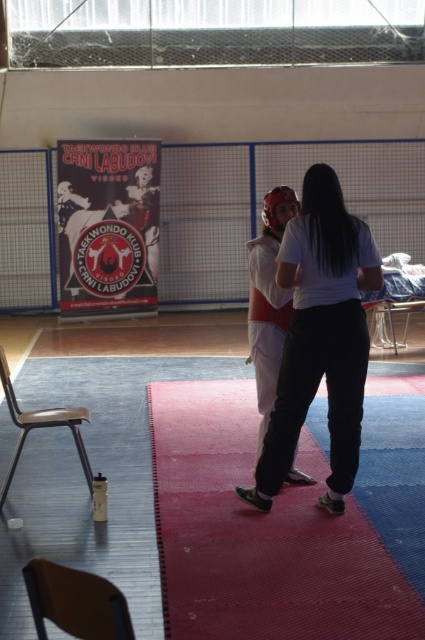
Between rubberized red mat at center and white cotton t-shirt at center, which one appears on the left side from the viewer's perspective?

rubberized red mat at center

Between point (229, 486) and point (260, 460), which one is positioned behind?

Point (229, 486)

Does point (311, 465) lie behind point (336, 204)?

Yes, point (311, 465) is farther from viewer.

Where is `rubberized red mat at center`? This screenshot has width=425, height=640. rubberized red mat at center is located at coordinates (260, 536).

Between point (190, 499) and point (265, 404), which one is positioned behind?

The point (265, 404) is more distant.

Can you confirm if rubberized red mat at center is bigger than white matte/soft t-shirt at center?

Indeed, rubberized red mat at center has a larger size compared to white matte/soft t-shirt at center.

Consider the image. Who is more distant from viewer, (238, 529) or (282, 220)?

The point (282, 220) is behind.

The width and height of the screenshot is (425, 640). I want to click on rubberized red mat at center, so click(x=260, y=536).

Between point (337, 458) and point (251, 266), which one is positioned behind?

The point (251, 266) is more distant.

You are a GUI agent. You are given a task and a screenshot of the screen. Output one action in this format:
    pyautogui.click(x=<x>, y=<y>)
    Task: Click on the white cotton t-shirt at center
    
    Given the screenshot: What is the action you would take?
    pyautogui.click(x=320, y=337)